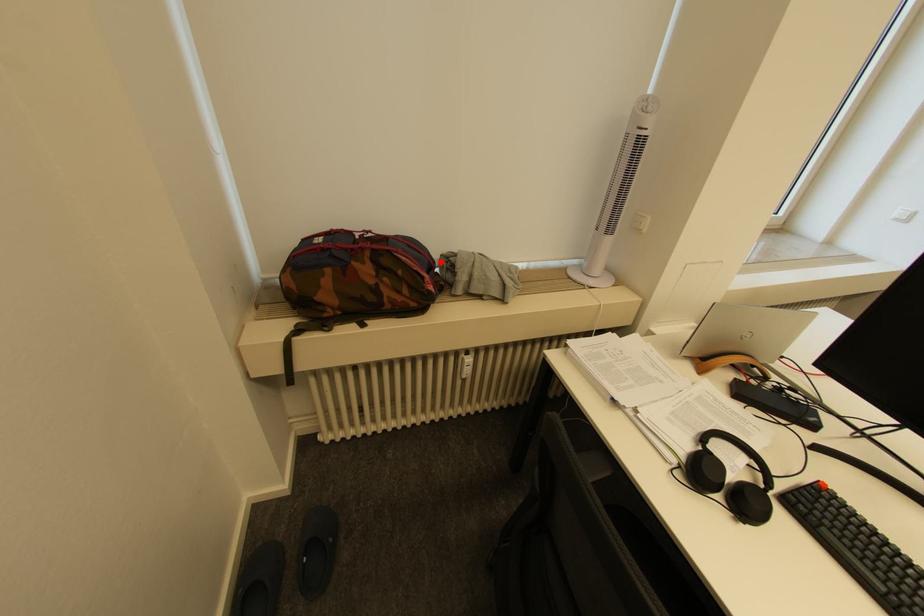
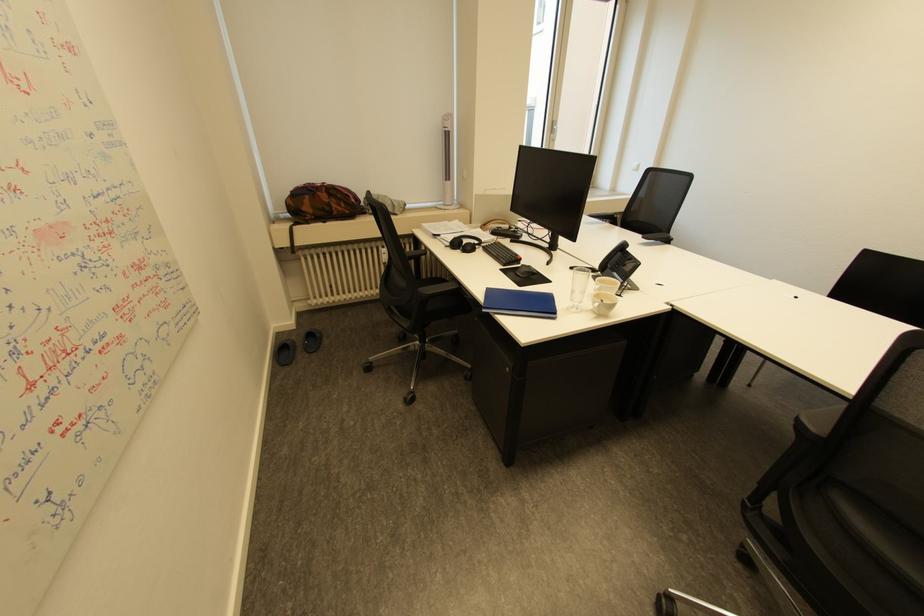
Question: I am providing you with two images of the same scene from different viewpoints. Image1 has a red point marked. In image2, the corresponding 3D location appears at what relative position? Reply with the corresponding letter.

Choices:
 (A) Closer
 (B) Farther

Answer: (B)